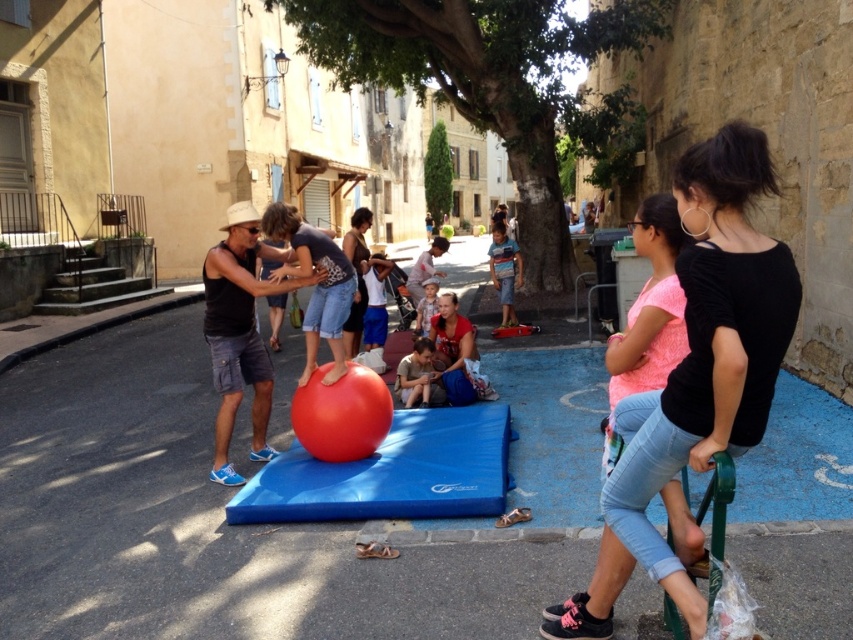
Between black matte shirt at upper right and light brown wooden chair at center, which one is positioned lower?

black matte shirt at upper right is below.

From the picture: Is black matte shirt at upper right to the right of light brown wooden chair at center from the viewer's perspective?

Correct, you'll find black matte shirt at upper right to the right of light brown wooden chair at center.

Which is in front, point (618, 472) or point (421, 332)?

Point (618, 472) is in front.

What are the coordinates of `black matte shirt at upper right` in the screenshot? It's located at click(695, 381).

What do you see at coordinates (695, 381) in the screenshot? This screenshot has width=853, height=640. I see `black matte shirt at upper right` at bounding box center [695, 381].

Can you confirm if black matte shirt at upper right is positioned to the left of rubber ball at center?

Incorrect, black matte shirt at upper right is not on the left side of rubber ball at center.

Between point (703, 170) and point (231, 218), which one is positioned behind?

The point (231, 218) is behind.

The image size is (853, 640). In order to click on black matte shirt at upper right in this screenshot , I will do `click(695, 381)`.

Where is `black matte shirt at upper right`? black matte shirt at upper right is located at coordinates (695, 381).

Can you confirm if black matte shirt at upper right is wider than smooth skin child at center?

Yes.

Is point (723, 371) closer to camera compared to point (401, 362)?

Yes, it is in front of point (401, 362).

Find the location of a particular element. The image size is (853, 640). black matte shirt at upper right is located at coordinates (695, 381).